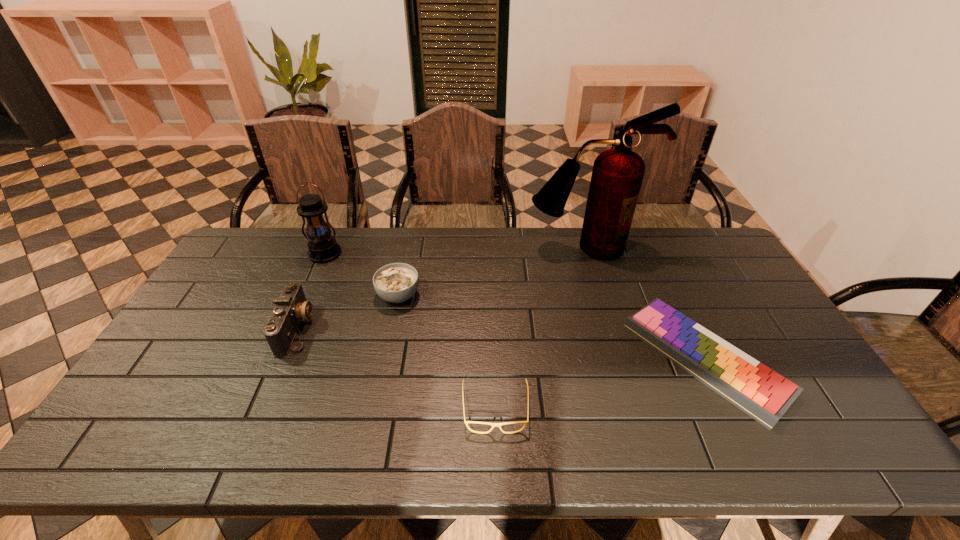
Identify the location of free space at the left edge. The height and width of the screenshot is (540, 960). (185, 326).

Where is `blank area at the right edge`? Image resolution: width=960 pixels, height=540 pixels. blank area at the right edge is located at coordinates [794, 367].

Image resolution: width=960 pixels, height=540 pixels. I want to click on free space at the far left corner, so click(x=284, y=230).

This screenshot has width=960, height=540. I want to click on free space at the far right corner of the desktop, so click(x=681, y=234).

What are the coordinates of `empty space between the camera and the fourth object from right to left` in the screenshot? It's located at 348,312.

Where is `free space between the third object from right to left and the computer keyboard`? free space between the third object from right to left and the computer keyboard is located at coordinates (600, 384).

Locate an element on the screen. The image size is (960, 540). vacant space that is in between the second tallest object and the fire extinguisher is located at coordinates (455, 251).

I want to click on vacant area that lies between the camera and the second tallest object, so click(311, 291).

The image size is (960, 540). What are the coordinates of `empty space between the lantern and the fire extinguisher` in the screenshot? It's located at (455, 251).

Locate an element on the screen. vacant area that lies between the fire extinguisher and the spectacles is located at coordinates (540, 328).